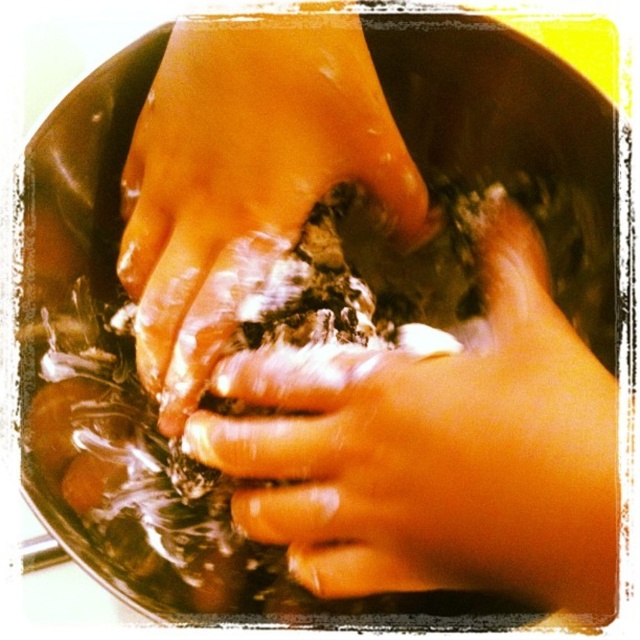
You are a dermatologist examining the image of two hands washing something. You notice there are two areas labeled as smooth skin hands at center and dry skin at center. Based on their size, which area would you recommend applying moisturizer to first?

The dry skin at center is taller than the smooth skin hands at center, so applying moisturizer to the dry skin at center first would be more effective as it covers a larger area.

You are a dermatologist examining a closeup of two hands submerged in water washing something. You notice the smooth skin hands at center and dry skin at center. Which hand is positioned lower in the water?

The smooth skin hands at center is below dry skin at center, so the smooth skin hands at center is positioned lower in the water.